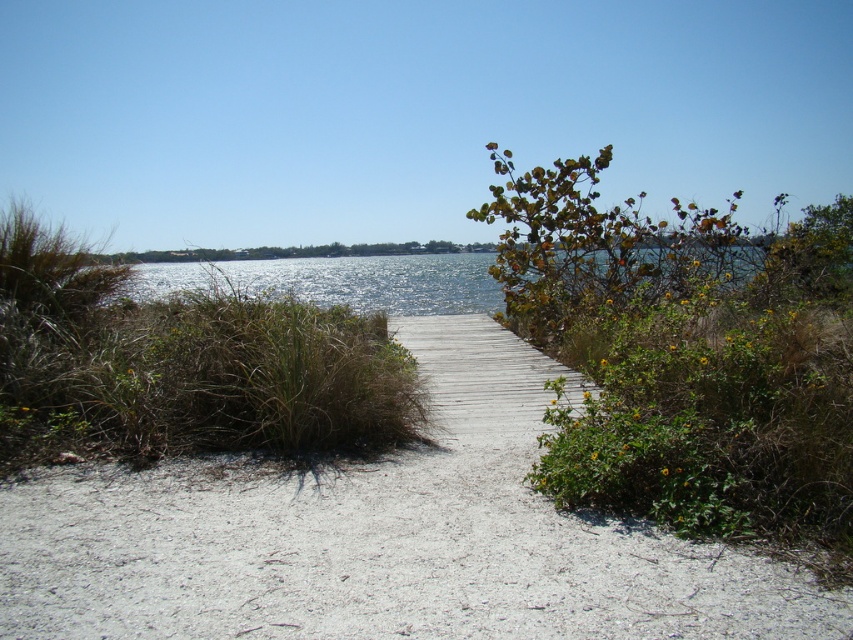
Question: Can you confirm if green leafy bush at upper right is smaller than glistening blue water at center?

Choices:
 (A) no
 (B) yes

Answer: (A)

Question: Is white sandy path at center to the right of green leafy bush at upper right from the viewer's perspective?

Choices:
 (A) no
 (B) yes

Answer: (A)

Question: Which point is closer to the camera?

Choices:
 (A) (791, 292)
 (B) (469, 280)
 (C) (328, 307)

Answer: (A)

Question: Is white sandy path at center positioned before green leafy bush at upper right?

Choices:
 (A) yes
 (B) no

Answer: (A)

Question: Which of the following is the farthest from the observer?

Choices:
 (A) (367, 586)
 (B) (136, 292)
 (C) (642, 344)

Answer: (B)

Question: Estimate the real-world distances between objects in this image. Which object is farther from the green grass at center?

Choices:
 (A) glistening blue water at center
 (B) white sandy path at center
 (C) green leafy bush at upper right

Answer: (A)